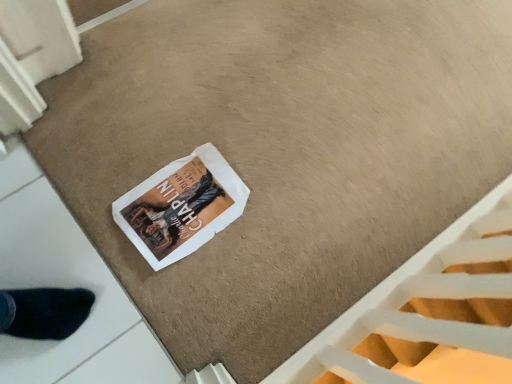
Identify the location of free location in front of white paper magazine at center. (140, 287).